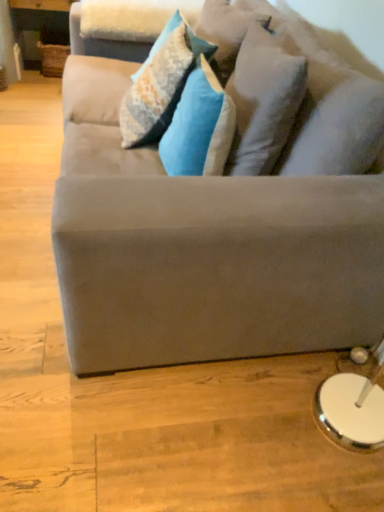
Question: Is velvet blue pillow at center, positioned as the 3th pillow in right-to-left order, closer to the viewer compared to suede gray couch at center?

Choices:
 (A) no
 (B) yes

Answer: (A)

Question: Does velvet blue pillow at center, positioned as the 3th pillow in right-to-left order, have a greater height compared to suede gray couch at center?

Choices:
 (A) yes
 (B) no

Answer: (B)

Question: From the image's perspective, is velvet blue pillow at center, which ranks as the first pillow in left-to-right order, beneath suede gray couch at center?

Choices:
 (A) yes
 (B) no

Answer: (B)

Question: Is velvet blue pillow at center, positioned as the 3th pillow in right-to-left order, not near suede gray couch at center?

Choices:
 (A) yes
 (B) no

Answer: (B)

Question: Is velvet blue pillow at center, positioned as the 3th pillow in right-to-left order, thinner than suede gray couch at center?

Choices:
 (A) yes
 (B) no

Answer: (A)

Question: Is point (294, 88) closer or farther from the camera than point (157, 103)?

Choices:
 (A) closer
 (B) farther

Answer: (A)

Question: In terms of width, does white soft pillow at upper center, which is the first pillow from right to left, look wider or thinner when compared to velvet blue pillow at center, which ranks as the first pillow in left-to-right order?

Choices:
 (A) wide
 (B) thin

Answer: (B)

Question: Visually, is white soft pillow at upper center, which is the first pillow from right to left, positioned to the left or to the right of velvet blue pillow at center, positioned as the 3th pillow in right-to-left order?

Choices:
 (A) left
 (B) right

Answer: (B)

Question: Looking at the image, does white soft pillow at upper center, which is the 3th pillow in left-to-right order, seem bigger or smaller compared to velvet blue pillow at center, positioned as the 3th pillow in right-to-left order?

Choices:
 (A) small
 (B) big

Answer: (A)

Question: In the image, is white soft pillow at upper center, which is the 3th pillow in left-to-right order, positioned in front of or behind textured blue pillow at center, which is the 2th pillow from right to left?

Choices:
 (A) behind
 (B) front

Answer: (B)

Question: Would you say white soft pillow at upper center, which is the first pillow from right to left, is inside or outside textured blue pillow at center, which is the 2th pillow from right to left?

Choices:
 (A) outside
 (B) inside

Answer: (A)

Question: In terms of width, does white soft pillow at upper center, which is the first pillow from right to left, look wider or thinner when compared to textured blue pillow at center, which is the 2th pillow from right to left?

Choices:
 (A) thin
 (B) wide

Answer: (A)

Question: In terms of size, does white soft pillow at upper center, which is the first pillow from right to left, appear bigger or smaller than textured blue pillow at center, which is counted as the 2th pillow, starting from the left?

Choices:
 (A) big
 (B) small

Answer: (A)

Question: Relative to white soft pillow at upper center, which is the 3th pillow in left-to-right order, is textured blue pillow at center, which is the 2th pillow from right to left, in front or behind?

Choices:
 (A) behind
 (B) front

Answer: (A)

Question: From a real-world perspective, is textured blue pillow at center, which is counted as the 2th pillow, starting from the left, above or below white soft pillow at upper center, which is the first pillow from right to left?

Choices:
 (A) above
 (B) below

Answer: (B)